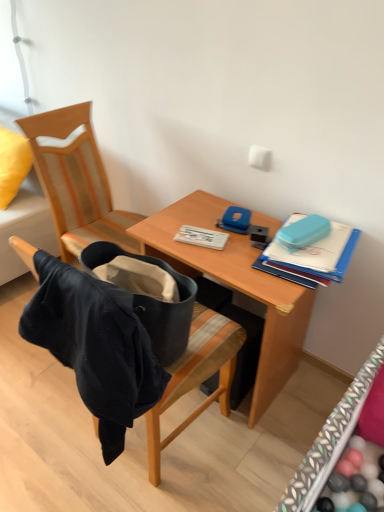
The height and width of the screenshot is (512, 384). What are the coordinates of `free region on the left part of velvet black bag at center, the first chair viewed from the front` in the screenshot? It's located at (41, 424).